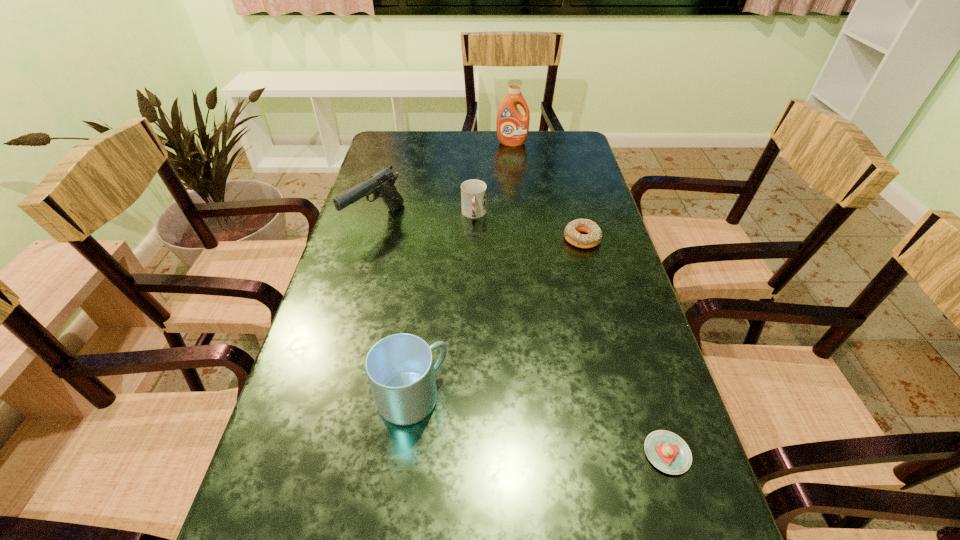
I want to click on vacant space at the far edge of the desktop, so click(x=528, y=156).

In order to click on free region at the left edge of the desktop in this screenshot , I will do `click(359, 202)`.

In order to click on free space at the right edge of the desktop in this screenshot , I will do `click(560, 203)`.

Identify the location of free space at the far right corner of the desktop. (579, 141).

Locate an element on the screen. free space that is in between the cup and the mug is located at coordinates (444, 306).

Identify the location of vacant space that is in between the detergent and the shortest object. This screenshot has width=960, height=540. (589, 298).

In order to click on vacant area that lies between the cup and the tallest object in this screenshot , I will do `click(492, 179)`.

Locate an element on the screen. This screenshot has width=960, height=540. vacant space that's between the fifth tallest object and the detergent is located at coordinates (546, 191).

The height and width of the screenshot is (540, 960). What are the coordinates of `free space between the cup and the fifth farthest object` in the screenshot? It's located at (444, 306).

Where is `empty location between the pastry and the detergent`? empty location between the pastry and the detergent is located at coordinates click(x=589, y=298).